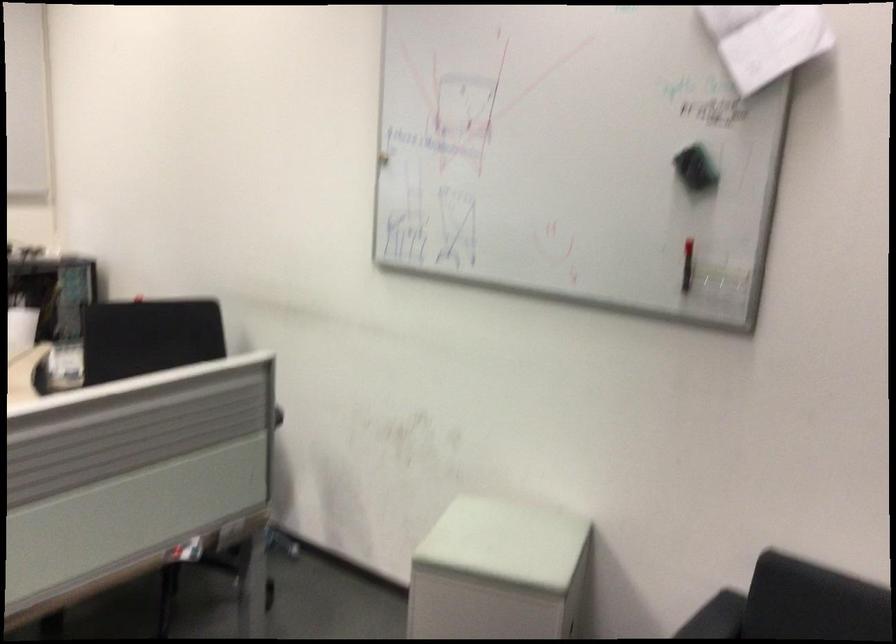
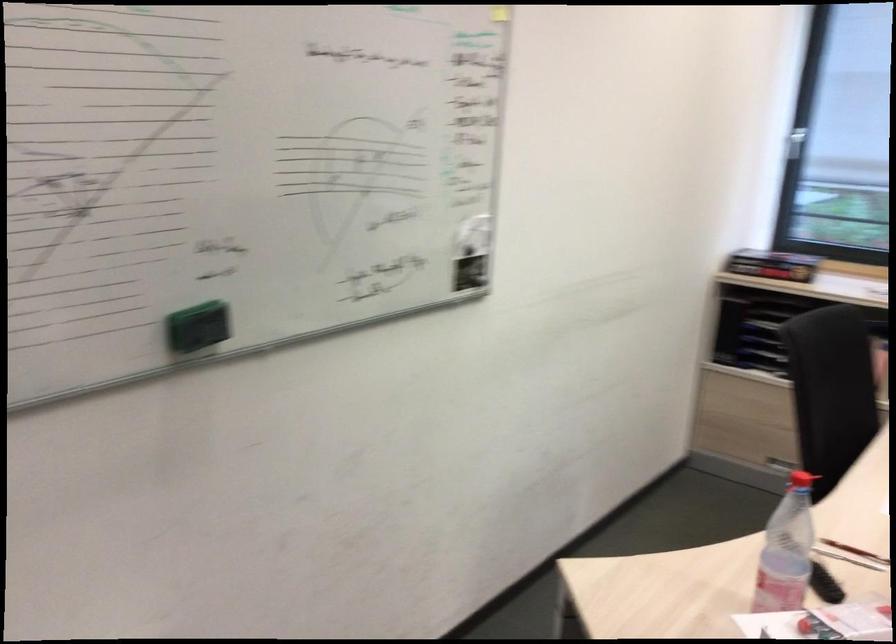
Question: The camera is either moving clockwise (left) or counter-clockwise (right) around the object. The first image is from the beginning of the video and the second image is from the end. Is the camera moving left or right when shooting the video?

Choices:
 (A) Left
 (B) Right

Answer: (B)